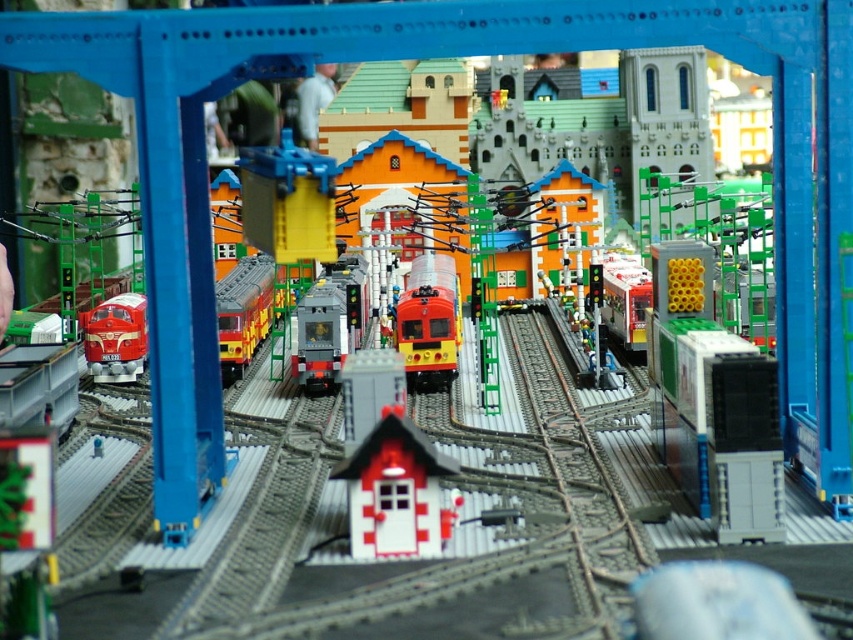
Question: Does shiny red train at left have a lesser width compared to matte red train at center?

Choices:
 (A) yes
 (B) no

Answer: (A)

Question: Which of the following is the closest to the observer?

Choices:
 (A) (138, 312)
 (B) (637, 321)

Answer: (A)

Question: Is shiny red train at center further to camera compared to shiny yellow train at center?

Choices:
 (A) yes
 (B) no

Answer: (B)

Question: Can you confirm if matte gray train at center is positioned below shiny red train at left?

Choices:
 (A) yes
 (B) no

Answer: (B)

Question: Which point appears farthest from the camera in this image?

Choices:
 (A) (113, 365)
 (B) (404, 518)

Answer: (A)

Question: Among these points, which one is farthest from the camera?

Choices:
 (A) (415, 268)
 (B) (325, 342)
 (C) (122, 301)

Answer: (A)